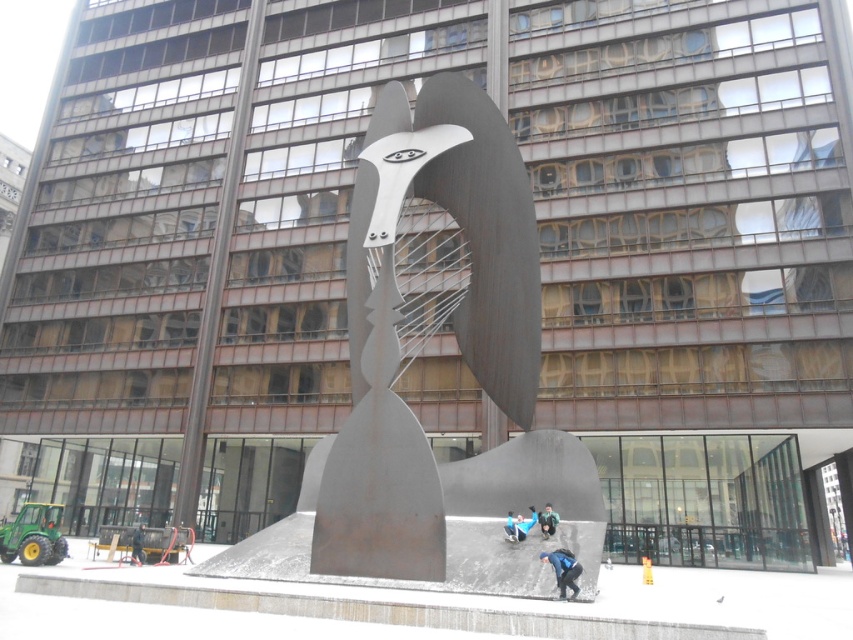
Can you confirm if rusty metal sculpture at center is bigger than dark blue jeans at center?

Yes.

Consider the image. Is rusty metal sculpture at center above dark blue jeans at center?

Yes.

Who is more forward, (370,317) or (544,529)?

Point (544,529)

Identify the location of rusty metal sculpture at center. (416, 353).

Does blue fabric at lower center have a larger size compared to dark blue jeans at center?

Correct, blue fabric at lower center is larger in size than dark blue jeans at center.

Is blue fabric at lower center to the right of dark blue jeans at center from the viewer's perspective?

Incorrect, blue fabric at lower center is not on the right side of dark blue jeans at center.

Is point (573, 566) more distant than point (550, 512)?

No, (573, 566) is closer to viewer.

Identify the location of blue fabric at lower center. pos(563,570).

Between rusty metal sculpture at center and blue fabric at lower center, which one has less height?

With less height is blue fabric at lower center.

Does rusty metal sculpture at center lie behind blue fabric at lower center?

Yes.

Between point (496, 113) and point (556, 561), which one is positioned behind?

Point (496, 113)

At what (x,y) coordinates should I click in order to perform the action: click on rusty metal sculpture at center. Please return your answer as a coordinate pair (x, y). Image resolution: width=853 pixels, height=640 pixels. Looking at the image, I should click on (416, 353).